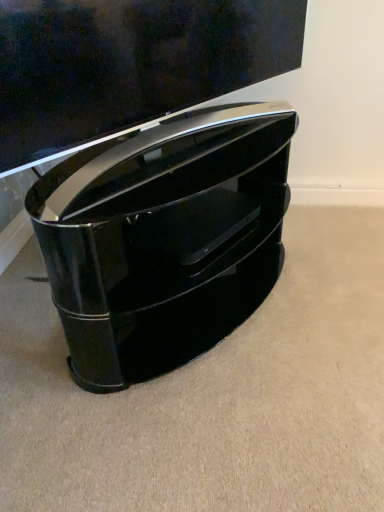
Where is `free space above glossy black tv stand at center (from a real-world perspective)`? free space above glossy black tv stand at center (from a real-world perspective) is located at coordinates (182, 149).